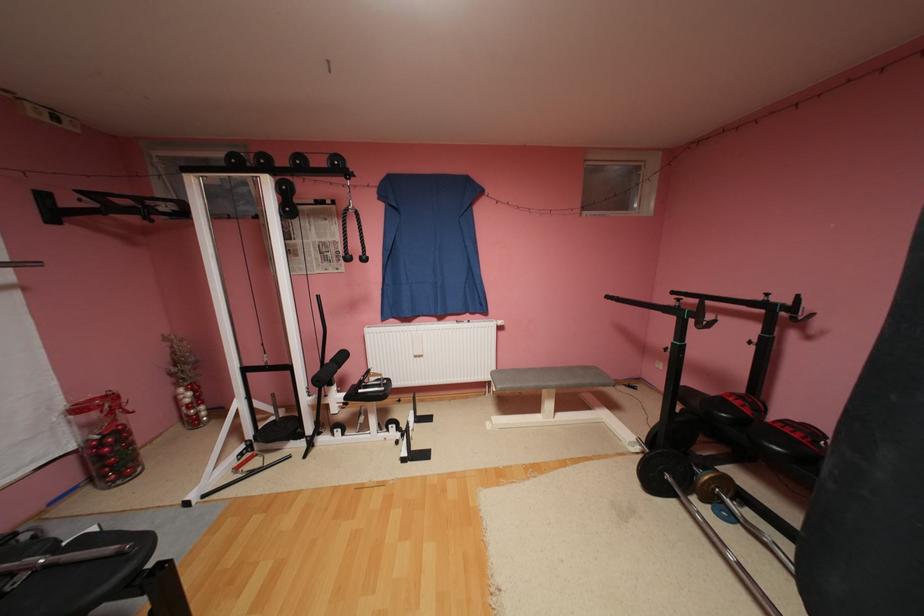
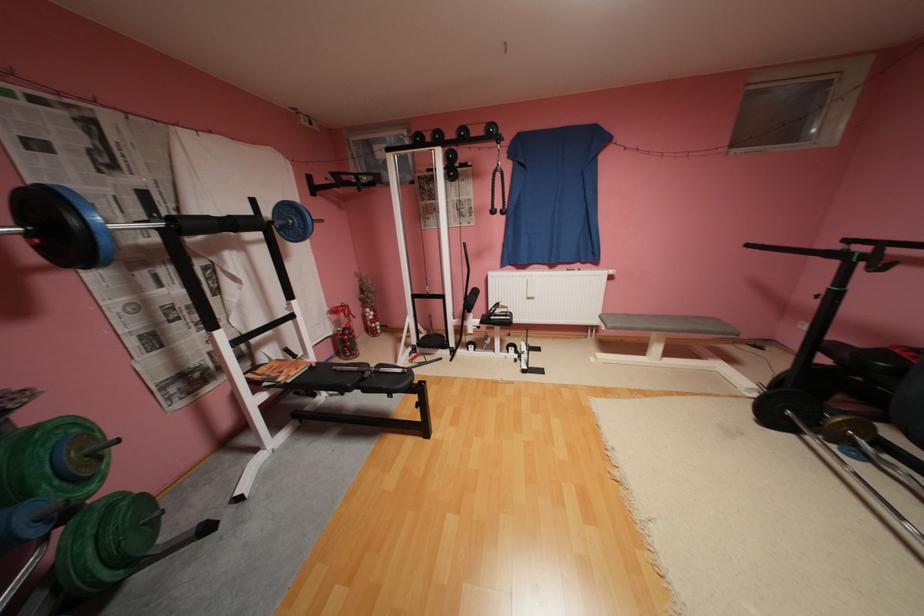
Where in the second image is the point corresponding to [552,384] from the first image?

(664, 326)